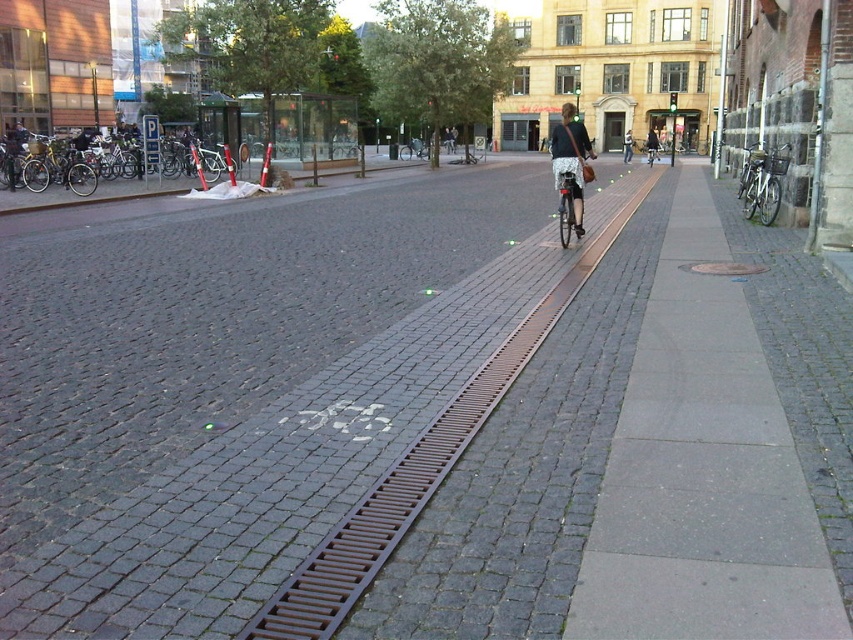
Can you confirm if matte black bicycle at center is thinner than shiny silver bicycle at center?

No.

Is point (561, 182) positioned after point (424, 148)?

That is False.

This screenshot has height=640, width=853. Find the location of `matte black bicycle at center`. matte black bicycle at center is located at coordinates (570, 172).

Which is below, shiny silver bicycle at center or dark gray jacket at center?

dark gray jacket at center is below.

Find the location of a particular element. The image size is (853, 640). shiny silver bicycle at center is located at coordinates (413, 148).

Can you confirm if silver metallic bicycle at center is wider than dark blue jeans at center?

Incorrect, silver metallic bicycle at center's width does not surpass dark blue jeans at center's.

Is point (570, 236) less distant than point (624, 141)?

Yes, it is in front of point (624, 141).

Where is `silver metallic bicycle at center`? The image size is (853, 640). silver metallic bicycle at center is located at coordinates (567, 198).